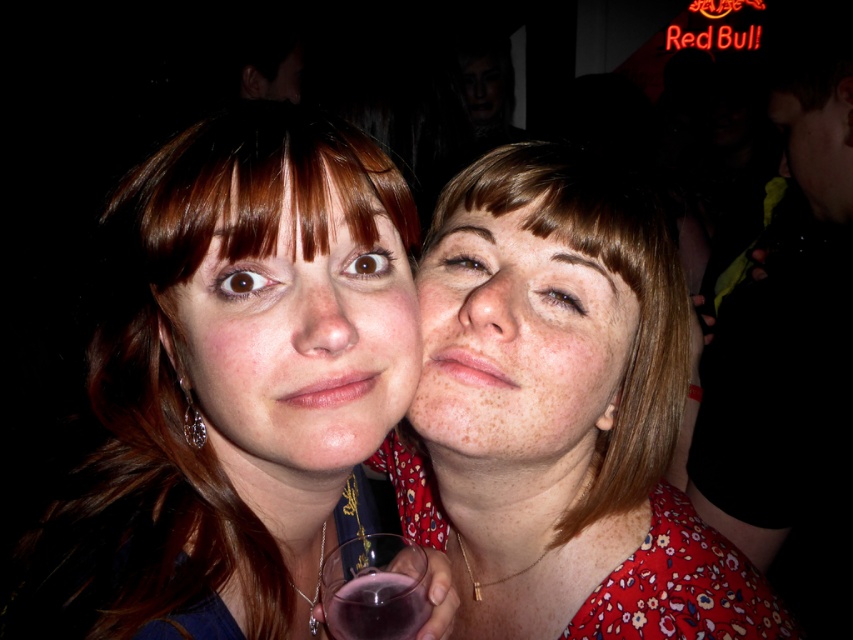
Does brown matte hair at center have a lesser height compared to transparent glass at center?

No.

Is brown matte hair at center above transparent glass at center?

Yes.

Who is more forward, (293, 202) or (393, 547)?

Point (293, 202) is in front.

The width and height of the screenshot is (853, 640). Find the location of `brown matte hair at center`. brown matte hair at center is located at coordinates (299, 193).

How much distance is there between freckled skin at center and dry skin nose at center?

freckled skin at center and dry skin nose at center are 1.86 inches apart from each other.

Is point (422, 292) positioned before point (456, 316)?

No, (422, 292) is behind (456, 316).

You are a GUI agent. You are given a task and a screenshot of the screen. Output one action in this format:
    pyautogui.click(x=<x>, y=<y>)
    Task: Click on the freckled skin at center
    The width and height of the screenshot is (853, 640).
    Given the screenshot: What is the action you would take?
    pyautogui.click(x=515, y=346)

Is floral fabric dress at center thinner than freckled skin at center?

Incorrect, floral fabric dress at center's width is not less than freckled skin at center's.

Find the location of a particular element. This screenshot has height=640, width=853. floral fabric dress at center is located at coordinates (564, 417).